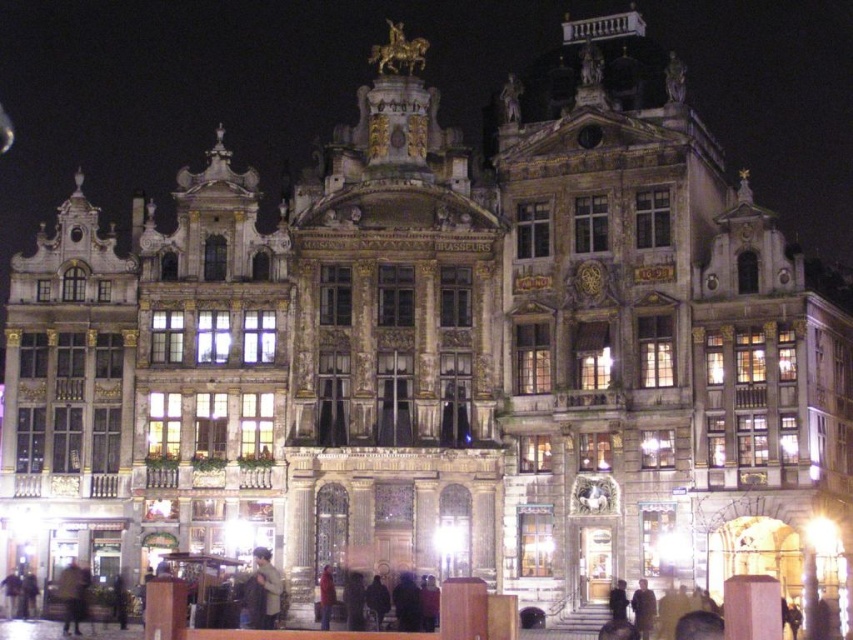
Who is taller, dark brown leather jacket at lower center or dark brown leather jacket at lower left?

dark brown leather jacket at lower left is taller.

Does dark brown leather jacket at lower center have a lesser width compared to dark brown leather jacket at lower left?

Indeed, dark brown leather jacket at lower center has a lesser width compared to dark brown leather jacket at lower left.

Between point (271, 588) and point (64, 612), which one is positioned in front?

Point (271, 588) is in front.

At what (x,y) coordinates should I click in order to perform the action: click on dark brown leather jacket at lower center. Please return your answer as a coordinate pair (x, y). Looking at the image, I should click on (267, 588).